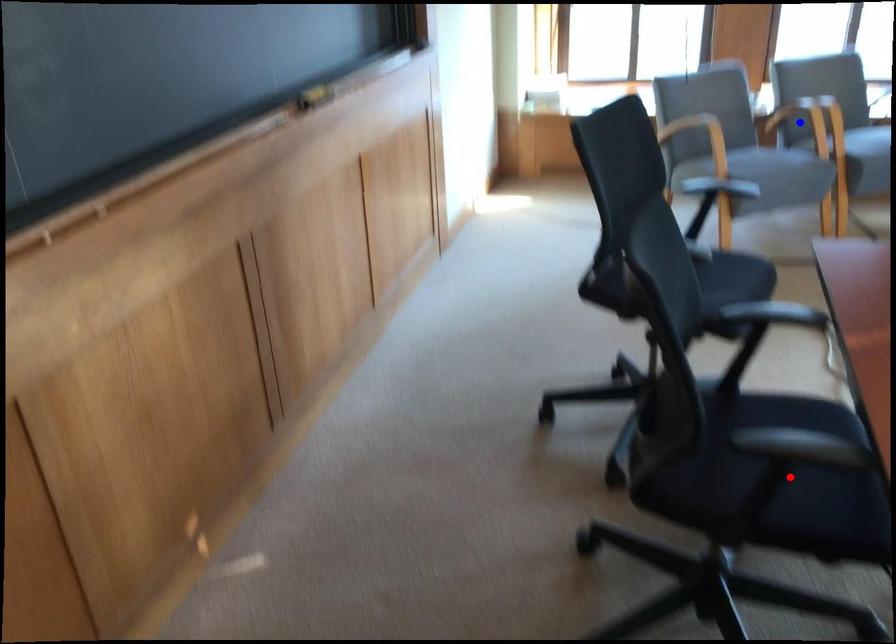
Question: In the image, two points are highlighted. Which point is nearer to the camera? Reply with the corresponding letter.

Choices:
 (A) blue point
 (B) red point

Answer: (B)